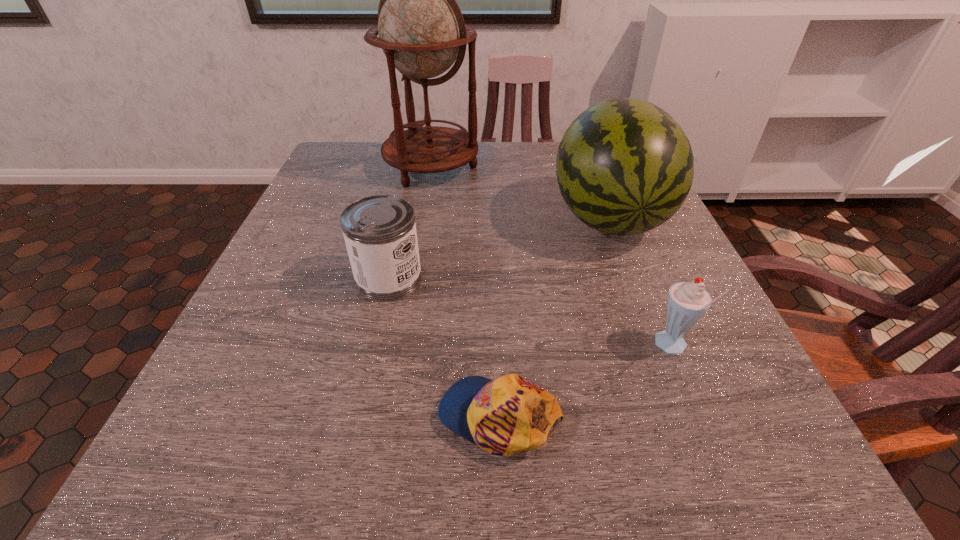
The width and height of the screenshot is (960, 540). What are the coordinates of `free location that satisfies the following two spatial constraints: 1. at the stem end of the watermelon; 2. on the bill of the shortest object` in the screenshot? It's located at (684, 416).